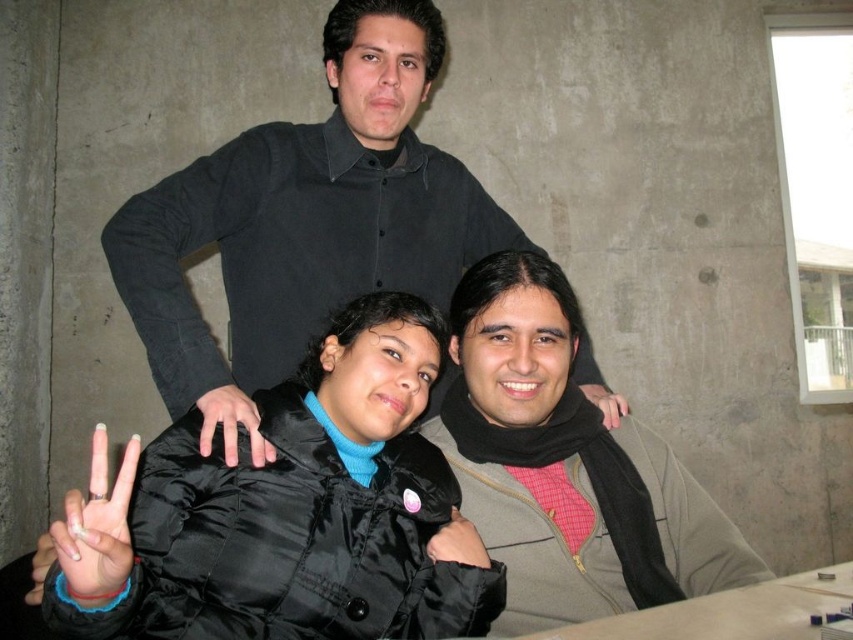
Is point (166, 577) behind point (122, 536)?

Yes, it is.

Is point (311, 396) closer to viewer compared to point (65, 500)?

That is False.

Is point (270, 564) less distant than point (107, 476)?

Yes, it is in front of point (107, 476).

This screenshot has height=640, width=853. In order to click on black satin jacket at center in this screenshot , I will do `click(286, 512)`.

Can you confirm if black satin jacket at center is positioned to the left of black matte hand at center?

No, black satin jacket at center is not to the left of black matte hand at center.

Does black satin jacket at center appear under black matte hand at center?

Yes, black satin jacket at center is below black matte hand at center.

Locate an element on the screen. black satin jacket at center is located at coordinates (286, 512).

Is the position of black matte shirt at upper center more distant than that of matte black hand at lower left?

Yes, it is.

Which is behind, point (244, 333) or point (67, 564)?

The point (244, 333) is more distant.

Where is `black matte shirt at upper center`? black matte shirt at upper center is located at coordinates (306, 214).